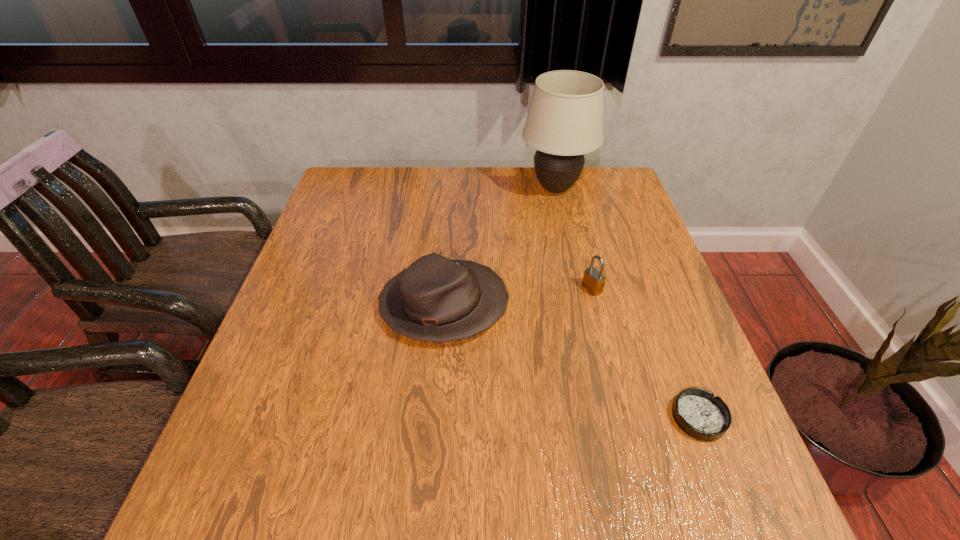
This screenshot has height=540, width=960. In order to click on lampshade in this screenshot , I will do `click(565, 118)`.

Identify the location of the tallest object. (565, 118).

Locate an element on the screen. This screenshot has width=960, height=540. the leftmost object is located at coordinates (436, 299).

I want to click on padlock, so click(x=593, y=280).

Identify the location of the rightmost object. (697, 412).

The height and width of the screenshot is (540, 960). What are the coordinates of `the nearest object` in the screenshot? It's located at (697, 412).

I want to click on free space located on the left of the farthest object, so tap(500, 188).

Where is `vacant area situated on the decorative side of the leftmost object`? vacant area situated on the decorative side of the leftmost object is located at coordinates (547, 306).

At what (x,y) coordinates should I click in order to perform the action: click on vacant space situated on the front of the padlock. Please return your answer as a coordinate pair (x, y). This screenshot has width=960, height=540. Looking at the image, I should click on (606, 343).

Find the location of a particular element. The height and width of the screenshot is (540, 960). vacant space located on the left of the nearest object is located at coordinates (613, 417).